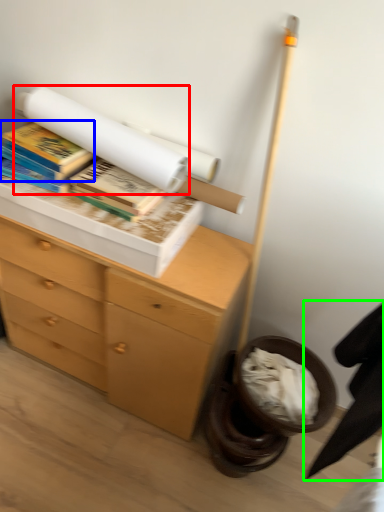
Question: Which object is the farthest from book (highlighted by a red box)? Choose among these: book (highlighted by a blue box) or swivel chair (highlighted by a green box).

Choices:
 (A) book
 (B) swivel chair

Answer: (B)